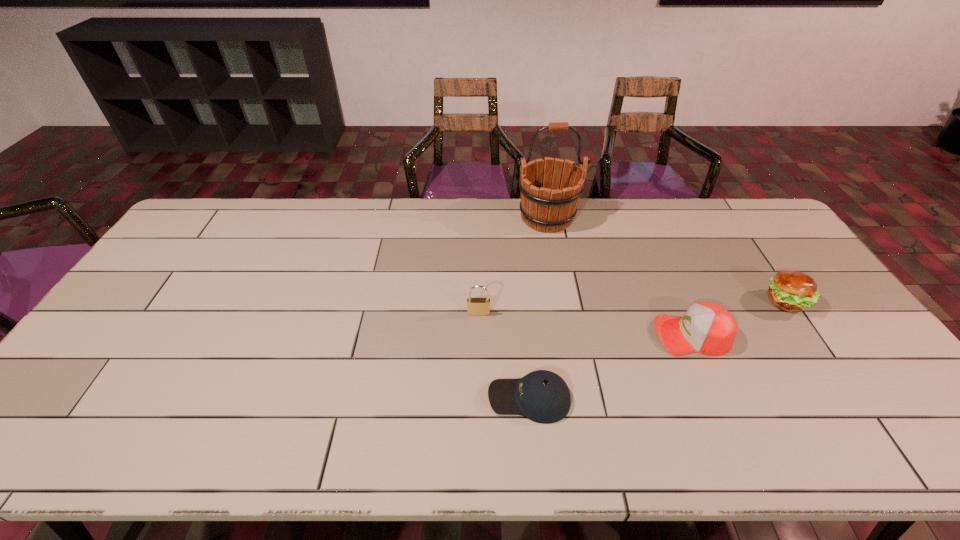
At what (x,y) coordinates should I click in order to perform the action: click on free location located 0.250m on the left of the hamburger. Please return your answer as a coordinate pair (x, y). Image resolution: width=960 pixels, height=540 pixels. Looking at the image, I should click on (679, 302).

Where is `vacant space located on the front-facing side of the right baseball cap`? The width and height of the screenshot is (960, 540). vacant space located on the front-facing side of the right baseball cap is located at coordinates (604, 335).

This screenshot has height=540, width=960. I want to click on vacant space located 0.090m on the front-facing side of the right baseball cap, so pyautogui.click(x=622, y=335).

Find the location of a particular element. Image resolution: width=960 pixels, height=540 pixels. vacant area situated on the front-facing side of the right baseball cap is located at coordinates (516, 335).

Find the location of `vacant space located 0.390m on the front-facing side of the nearer baseball cap`. vacant space located 0.390m on the front-facing side of the nearer baseball cap is located at coordinates (326, 399).

What are the coordinates of `free region located 0.130m on the front-facing side of the nearer baseball cap` in the screenshot? It's located at (434, 399).

Identify the location of blank area located on the front-facing side of the nearer baseball cap. tap(380, 399).

Identify the location of object at the far edge. This screenshot has width=960, height=540. (545, 207).

The image size is (960, 540). In order to click on object positioned at the near edge in this screenshot , I will do `click(542, 396)`.

The width and height of the screenshot is (960, 540). I want to click on object positioned at the right edge, so click(x=791, y=291).